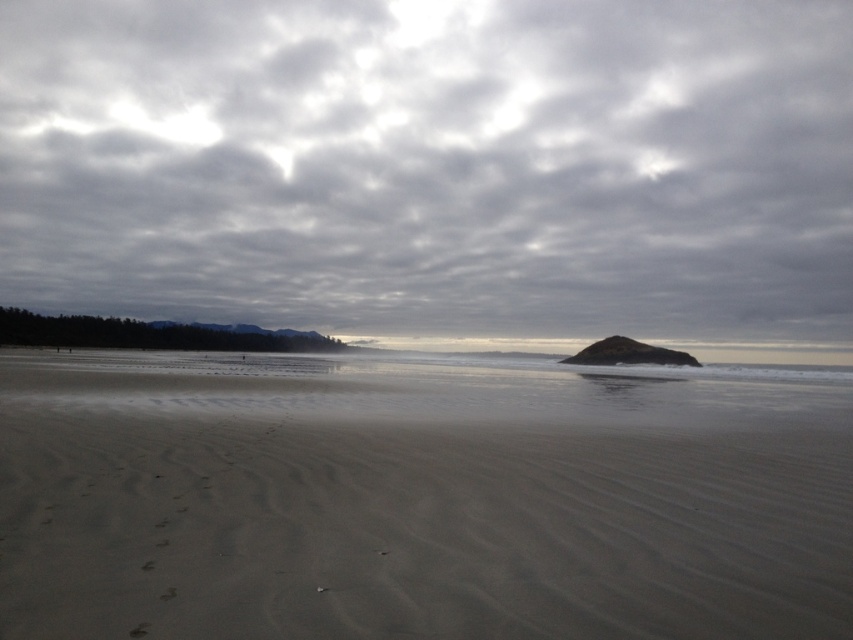
Can you confirm if cloudy sky at upper center is wider than smooth sand at center?

Yes.

Who is more distant from viewer, (752,288) or (636,416)?

The point (752,288) is behind.

You are a GUI agent. You are given a task and a screenshot of the screen. Output one action in this format:
    pyautogui.click(x=<x>, y=<y>)
    Task: Click on the cloudy sky at upper center
    The height and width of the screenshot is (640, 853).
    Given the screenshot: What is the action you would take?
    pyautogui.click(x=433, y=164)

Identify the location of cloudy sky at upper center. (433, 164).